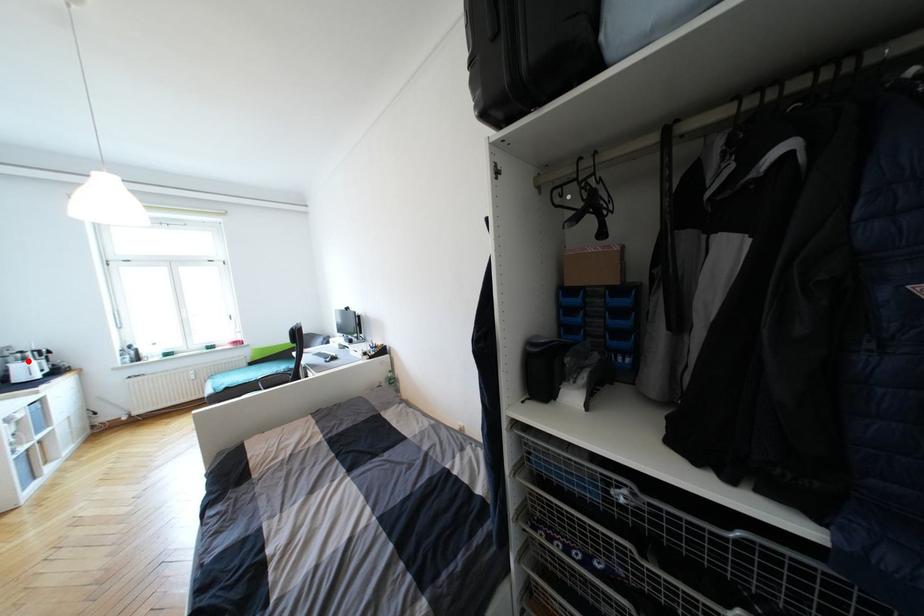
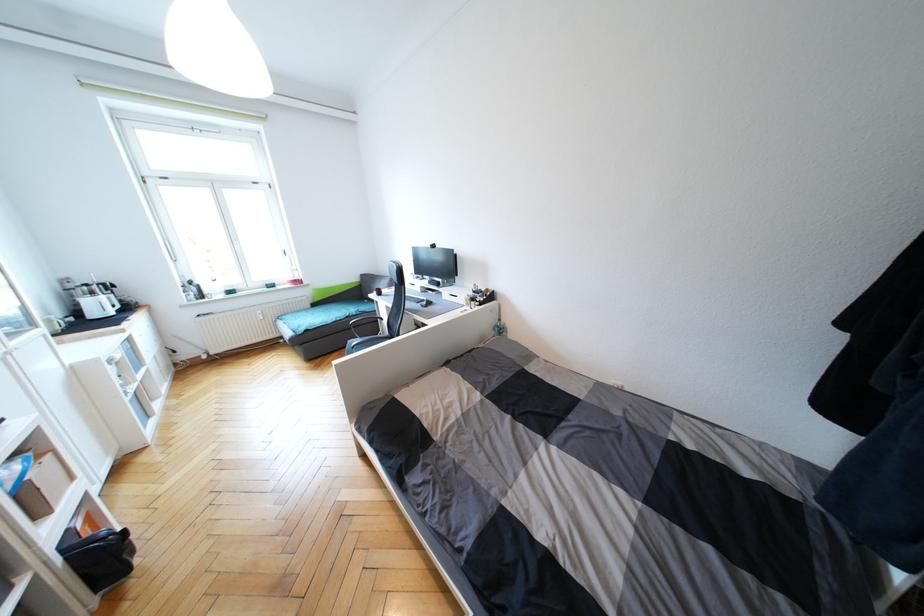
Locate, in the second image, the point that corresponds to the highlighted location in the first image.

(95, 294)